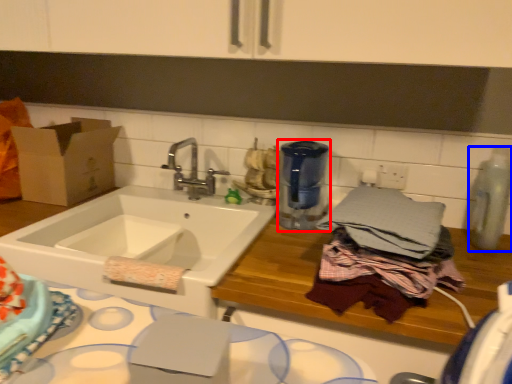
Question: Which of the following is the closest to the observer, appliance (highlighted by a red box) or appliance (highlighted by a blue box)?

Choices:
 (A) appliance
 (B) appliance

Answer: (B)